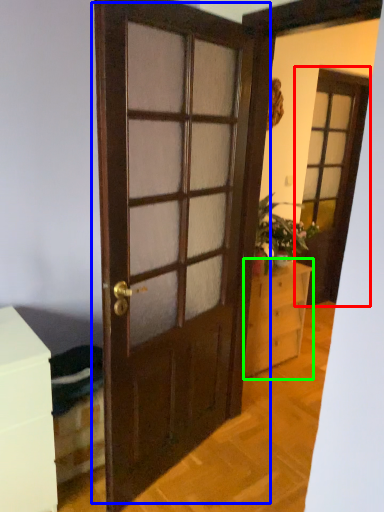
Question: Which is farther away from screen door (highlighted by a red box)? door (highlighted by a blue box) or chest of drawers (highlighted by a green box)?

Choices:
 (A) door
 (B) chest of drawers

Answer: (A)